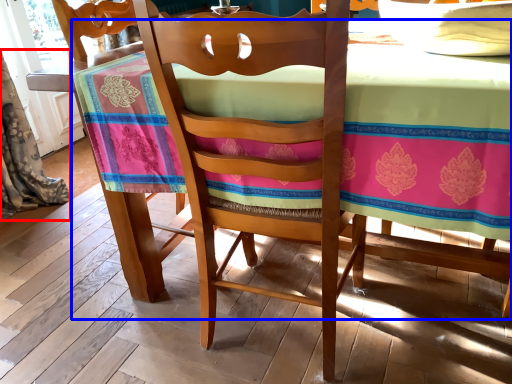
Question: Which point is closer to the camera, curtain (highlighted by a red box) or table (highlighted by a blue box)?

Choices:
 (A) curtain
 (B) table

Answer: (B)